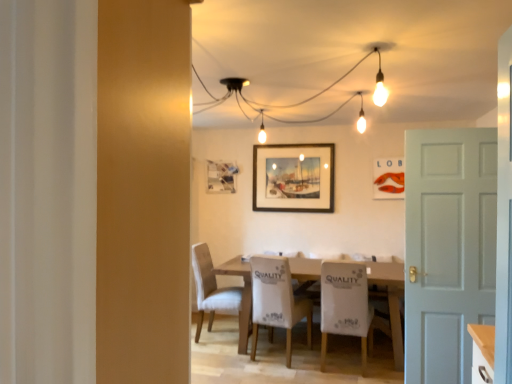
Question: Is white fabric chair at center, which is the first chair from right to left, in front of light beige fabric chair at center, the 1th chair from the left?

Choices:
 (A) no
 (B) yes

Answer: (B)

Question: Is white fabric chair at center, placed as the third chair when sorted from left to right, facing towards light beige fabric chair at center, the 1th chair from the left?

Choices:
 (A) yes
 (B) no

Answer: (B)

Question: Is white fabric chair at center, which is the first chair from right to left, not close to light beige fabric chair at center, placed as the third chair when sorted from right to left?

Choices:
 (A) yes
 (B) no

Answer: (A)

Question: Considering the relative sizes of white fabric chair at center, which is the first chair from right to left, and light beige fabric chair at center, the 1th chair from the left, in the image provided, is white fabric chair at center, which is the first chair from right to left, taller than light beige fabric chair at center, the 1th chair from the left,?

Choices:
 (A) no
 (B) yes

Answer: (A)

Question: Does white fabric chair at center, placed as the third chair when sorted from left to right, have a smaller size compared to light beige fabric chair at center, the 1th chair from the left?

Choices:
 (A) no
 (B) yes

Answer: (B)

Question: From the image's perspective, is white fabric chair at center, placed as the third chair when sorted from left to right, under light beige fabric chair at center, placed as the third chair when sorted from right to left?

Choices:
 (A) yes
 (B) no

Answer: (B)

Question: Is matte orange lobster at upper center, placed as the 3th picture frame when sorted from left to right, positioned before white matte door at right?

Choices:
 (A) yes
 (B) no

Answer: (B)

Question: From a real-world perspective, is matte orange lobster at upper center, which is counted as the 1th picture frame, starting from the right, located higher than white matte door at right?

Choices:
 (A) yes
 (B) no

Answer: (A)

Question: Is matte orange lobster at upper center, placed as the 3th picture frame when sorted from left to right, to the left of white matte door at right from the viewer's perspective?

Choices:
 (A) no
 (B) yes

Answer: (A)

Question: Is matte orange lobster at upper center, which is the 1th picture frame in front-to-back order, not within white matte door at right?

Choices:
 (A) no
 (B) yes

Answer: (B)

Question: Is white matte door at right inside matte orange lobster at upper center, which is counted as the 1th picture frame, starting from the right?

Choices:
 (A) no
 (B) yes

Answer: (A)

Question: From the image's perspective, would you say matte orange lobster at upper center, which is counted as the 1th picture frame, starting from the right, is shown under white matte door at right?

Choices:
 (A) yes
 (B) no

Answer: (B)

Question: From the image's perspective, is white fabric chair at center, placed as the third chair when sorted from left to right, under wooden framed painting at center, positioned as the second picture frame in left-to-right order?

Choices:
 (A) yes
 (B) no

Answer: (A)